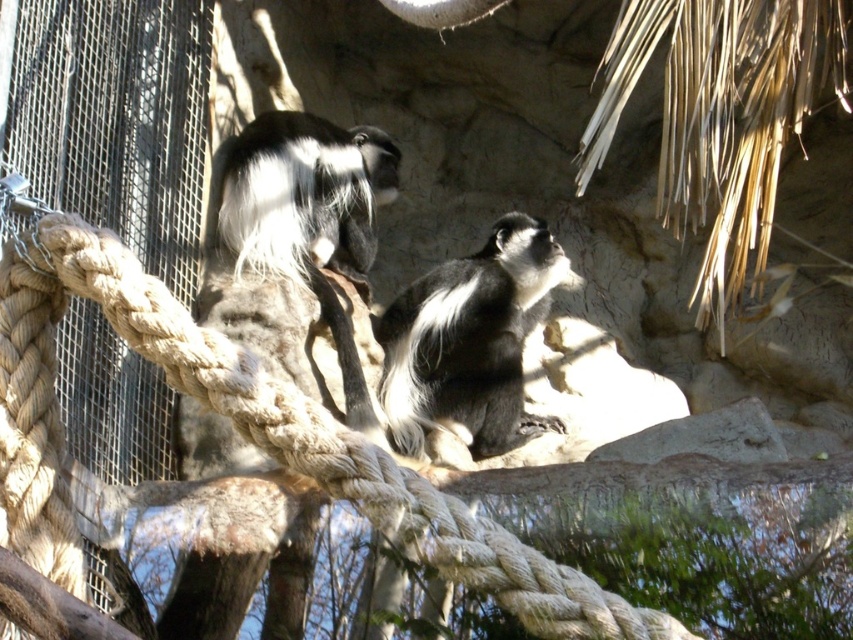
Based on the scene description, where is the black and white fur monkey at center located in the image?

The black and white fur monkey at center is located at the 2D coordinates point (469, 342) in the image.

You are a zookeeper observing the two monkeys in the enclosure. You notice the black and white fur monkey at center and the black and white fur monkey at upper center. Which of these two monkeys is larger in size?

The black and white fur monkey at center is taller than the black and white fur monkey at upper center, so it is larger in size.

Looking at this image, you are a zookeeper who needs to ensure each monkey has enough space to move freely. Given that the enclosure has a minimum space requirement of 1.5 meters between monkeys, can you determine if the distance between the black and white fur monkey at center and the black and white fur monkey at upper center meets this requirement based on their sizes?

The black and white fur monkey at center is larger in width than the black and white fur monkey at upper center. However, the exact distance between them isn not provided in the objects description. Therefore, it is impossible to determine if the 1.5 meter requirement is met without additional information about their actual separation.